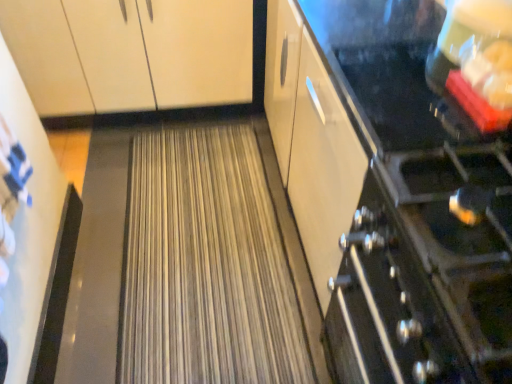
Question: Does satin black stove at right come in front of matte white cabinet at upper left?

Choices:
 (A) yes
 (B) no

Answer: (A)

Question: Considering the relative positions of satin black stove at right and matte white cabinet at upper left in the image provided, is satin black stove at right to the right of matte white cabinet at upper left from the viewer's perspective?

Choices:
 (A) no
 (B) yes

Answer: (B)

Question: Considering the relative sizes of satin black stove at right and matte white cabinet at upper left in the image provided, is satin black stove at right wider than matte white cabinet at upper left?

Choices:
 (A) yes
 (B) no

Answer: (B)

Question: Does satin black stove at right have a lesser height compared to matte white cabinet at upper left?

Choices:
 (A) yes
 (B) no

Answer: (B)

Question: Does satin black stove at right come behind matte white cabinet at upper left?

Choices:
 (A) no
 (B) yes

Answer: (A)

Question: From a real-world perspective, does satin black stove at right sit lower than matte white cabinet at upper left?

Choices:
 (A) yes
 (B) no

Answer: (B)

Question: Does matte white cabinet at upper left touch satin black stove at right?

Choices:
 (A) no
 (B) yes

Answer: (A)

Question: Is the position of matte white cabinet at upper left less distant than that of satin black stove at right?

Choices:
 (A) yes
 (B) no

Answer: (B)

Question: Is matte white cabinet at upper left not inside satin black stove at right?

Choices:
 (A) yes
 (B) no

Answer: (A)

Question: Considering the relative sizes of matte white cabinet at upper left and satin black stove at right in the image provided, is matte white cabinet at upper left taller than satin black stove at right?

Choices:
 (A) no
 (B) yes

Answer: (A)

Question: Can you confirm if matte white cabinet at upper left is bigger than satin black stove at right?

Choices:
 (A) no
 (B) yes

Answer: (A)

Question: Can you confirm if matte white cabinet at upper left is positioned to the left of satin black stove at right?

Choices:
 (A) no
 (B) yes

Answer: (B)

Question: Based on their positions, is satin black stove at right located to the left or right of matte white cabinet at upper left?

Choices:
 (A) left
 (B) right

Answer: (B)